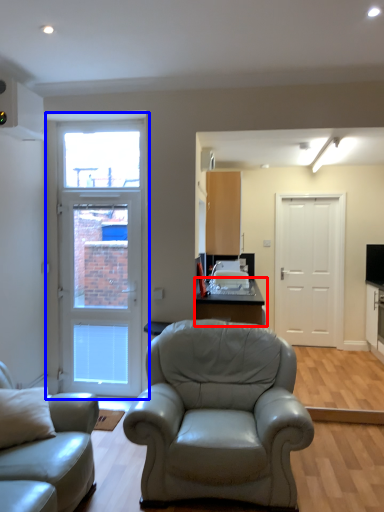
Question: Which object is closer to the camera taking this photo, table (highlighted by a red box) or door (highlighted by a blue box)?

Choices:
 (A) table
 (B) door

Answer: (A)